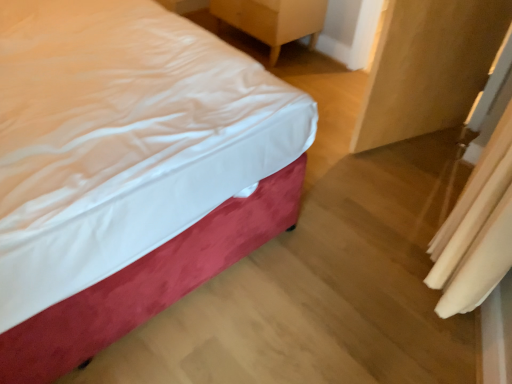
Image resolution: width=512 pixels, height=384 pixels. Identify the location of matte wood armoire at right. (429, 67).

Describe the element at coordinates (126, 170) in the screenshot. Image resolution: width=512 pixels, height=384 pixels. I see `velvet-like red bed at left` at that location.

I want to click on matte wood armoire at right, so click(429, 67).

Does white fabric curtain at lower right have a greater height compared to matte wood armoire at right?

Incorrect, the height of white fabric curtain at lower right is not larger of that of matte wood armoire at right.

Do you think white fabric curtain at lower right is within matte wood armoire at right, or outside of it?

white fabric curtain at lower right lies outside matte wood armoire at right.

From a real-world perspective, relative to matte wood armoire at right, is white fabric curtain at lower right vertically above or below?

From a real-world perspective, white fabric curtain at lower right is physically above matte wood armoire at right.

Which is behind, white fabric curtain at lower right or wooden nightstand at upper right?

wooden nightstand at upper right is behind.

Is white fabric curtain at lower right outside of wooden nightstand at upper right?

Yes, white fabric curtain at lower right is outside of wooden nightstand at upper right.

Does point (465, 269) lie behind point (275, 58)?

No.

Does white fabric curtain at lower right appear on the right side of wooden nightstand at upper right?

Indeed, white fabric curtain at lower right is positioned on the right side of wooden nightstand at upper right.

Is velvet-like red bed at left to the left or to the right of matte wood armoire at right in the image?

velvet-like red bed at left is positioned on matte wood armoire at right's left side.

Is velvet-like red bed at left positioned behind matte wood armoire at right?

No, it is not.

From a real-world perspective, is velvet-like red bed at left under matte wood armoire at right?

Yes, from a real-world perspective, velvet-like red bed at left is beneath matte wood armoire at right.

Which is more to the left, wooden nightstand at upper right or velvet-like red bed at left?

velvet-like red bed at left.

Locate an element on the screen. This screenshot has width=512, height=384. furniture that appears on the right of velvet-like red bed at left is located at coordinates (273, 20).

Which is behind, point (327, 0) or point (102, 147)?

Positioned behind is point (327, 0).

How different are the orientations of white fabric curtain at lower right and velvet-like red bed at left in degrees?

There is a 119-degree angle between the facing directions of white fabric curtain at lower right and velvet-like red bed at left.

From a real-world perspective, between white fabric curtain at lower right and velvet-like red bed at left, who is vertically lower?

velvet-like red bed at left is physically lower.

Is white fabric curtain at lower right shorter than velvet-like red bed at left?

No, white fabric curtain at lower right is not shorter than velvet-like red bed at left.

Find the location of a particular element. bed on the left of white fabric curtain at lower right is located at coordinates (126, 170).

Can you confirm if matte wood armoire at right is taller than wooden nightstand at upper right?

Yes, matte wood armoire at right is taller than wooden nightstand at upper right.

Looking at this image, would you consider matte wood armoire at right to be distant from wooden nightstand at upper right?

matte wood armoire at right is positioned a significant distance from wooden nightstand at upper right.

Which point is more distant from viewer, (452, 120) or (239, 13)?

Positioned behind is point (239, 13).

How many degrees apart are the facing directions of matte wood armoire at right and wooden nightstand at upper right?

matte wood armoire at right and wooden nightstand at upper right are facing 105 degrees away from each other.

Can you tell me how much velvet-like red bed at left and white fabric curtain at lower right differ in facing direction?

119 degrees.

Does velvet-like red bed at left have a greater width compared to white fabric curtain at lower right?

Correct, the width of velvet-like red bed at left exceeds that of white fabric curtain at lower right.

Is velvet-like red bed at left oriented towards white fabric curtain at lower right?

No, velvet-like red bed at left is not aimed at white fabric curtain at lower right.

Locate an element on the screen. This screenshot has height=384, width=512. curtain in front of the matte wood armoire at right is located at coordinates (477, 231).

What are the coordinates of `furniture that is under the white fabric curtain at lower right (from a real-world perspective)` in the screenshot? It's located at tap(273, 20).

When comparing their distances from velvet-like red bed at left, does wooden nightstand at upper right or matte wood armoire at right seem further?

Among the two, wooden nightstand at upper right is located further to velvet-like red bed at left.

Considering their positions, is matte wood armoire at right positioned closer to wooden nightstand at upper right than white fabric curtain at lower right?

matte wood armoire at right.

From the image, which object appears to be farther from matte wood armoire at right, wooden nightstand at upper right or velvet-like red bed at left?

velvet-like red bed at left lies further to matte wood armoire at right than the other object.

Looking at the image, which one is located further to white fabric curtain at lower right, velvet-like red bed at left or wooden nightstand at upper right?

wooden nightstand at upper right is positioned further to the anchor white fabric curtain at lower right.

When comparing their distances from white fabric curtain at lower right, does wooden nightstand at upper right or matte wood armoire at right seem closer?

The object closer to white fabric curtain at lower right is matte wood armoire at right.

Which object lies further to the anchor point matte wood armoire at right, wooden nightstand at upper right or white fabric curtain at lower right?

wooden nightstand at upper right lies further to matte wood armoire at right than the other object.

Which object lies further to the anchor point wooden nightstand at upper right, velvet-like red bed at left or matte wood armoire at right?

velvet-like red bed at left.

From the picture: Based on their spatial positions, is velvet-like red bed at left or white fabric curtain at lower right closer to matte wood armoire at right?

white fabric curtain at lower right lies closer to matte wood armoire at right than the other object.

Locate an element on the screen. armoire between velvet-like red bed at left and wooden nightstand at upper right along the z-axis is located at coordinates (429, 67).

At what (x,y) coordinates should I click in order to perform the action: click on curtain between velvet-like red bed at left and wooden nightstand at upper right in the front-back direction. Please return your answer as a coordinate pair (x, y). This screenshot has width=512, height=384. Looking at the image, I should click on (477, 231).

This screenshot has height=384, width=512. What are the coordinates of `armoire between white fabric curtain at lower right and wooden nightstand at upper right in the front-back direction` in the screenshot? It's located at pyautogui.click(x=429, y=67).

Find the location of a particular element. The width and height of the screenshot is (512, 384). curtain between velvet-like red bed at left and matte wood armoire at right from left to right is located at coordinates (477, 231).